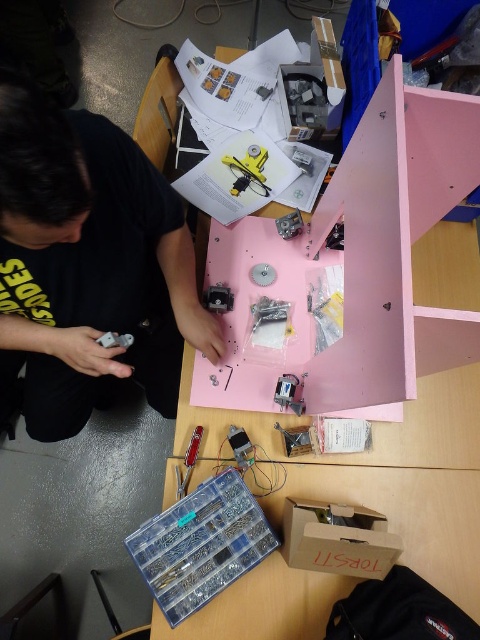
Question: Which point is farther to the camera?

Choices:
 (A) matte black shirt at upper left
 (B) yellow plastic gear at center

Answer: (B)

Question: Is pink matte table at center below cardboard box at lower center?

Choices:
 (A) no
 (B) yes

Answer: (A)

Question: Which object is positioned farthest from the yellow plastic gear at center?

Choices:
 (A) matte black shirt at upper left
 (B) pink matte table at center

Answer: (B)

Question: Can you confirm if pink matte table at center is positioned to the right of cardboard box at lower center?

Choices:
 (A) yes
 (B) no

Answer: (A)

Question: Which point is farther from the camera taking this photo?

Choices:
 (A) (261, 170)
 (B) (298, 564)
 (C) (247, 316)
 (D) (167, 282)

Answer: (A)

Question: Is cardboard box at lower center wider than yellow plastic gear at center?

Choices:
 (A) yes
 (B) no

Answer: (A)